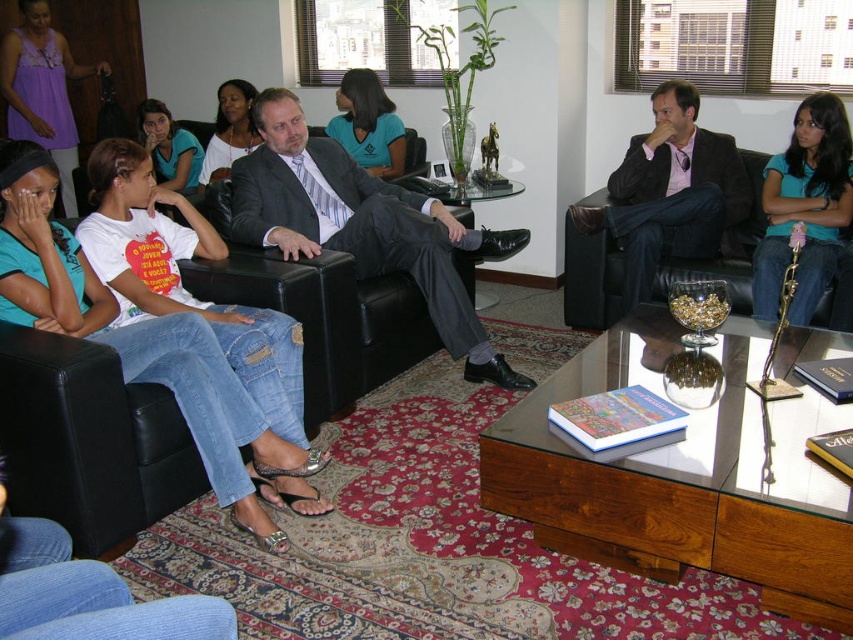
You are attending a meeting in the office and need to choose between the teal matte shirt at upper right and the matte black dress at center for your presentation. Based on their sizes, which one might be more suitable for a professional setting where comfort and ease of movement are important?

The teal matte shirt at upper right is taller than the matte black dress at center, so the dress might be more comfortable and easier to move in during the presentation.

You are an interior designer planning to place a floor lamp next to the black leather couch at center and the matte teal shirt at center. Which object should the lamp be positioned closer to in order to provide adequate lighting for the taller object?

The black leather couch at center is much taller than the matte teal shirt at center, so the floor lamp should be positioned closer to the black leather couch at center to provide adequate lighting for the taller object.

You are standing at the entrance of the office and want to sit on the black leather couch at center. Based on the coordinates provided, in which direction should you move relative to your current position?

The black leather couch at center is located at coordinates point (590, 266), so you should move towards the center of the room to reach it.